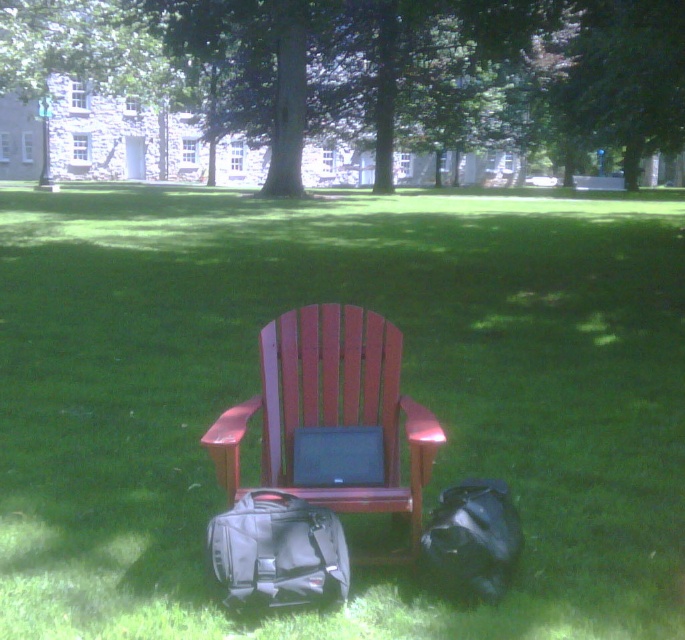
Which is above, green grass at center or black matte bag at lower right?

green grass at center is above.

Between green grass at center and black matte bag at lower right, which one appears on the left side from the viewer's perspective?

green grass at center is more to the left.

Between point (560, 392) and point (473, 497), which one is positioned behind?

The point (560, 392) is more distant.

Identify the location of green grass at center. (401, 390).

Who is higher up, green leafy tree at upper center or black fabric backpack at lower left?

Positioned higher is green leafy tree at upper center.

Consider the image. Who is more distant from viewer, (640, 72) or (329, 579)?

The point (640, 72) is more distant.

Image resolution: width=685 pixels, height=640 pixels. What are the coordinates of `green leafy tree at upper center` in the screenshot? It's located at (625, 77).

Between green grass at center and green leafy tree at center, which one is positioned higher?

green leafy tree at center is higher up.

Can you confirm if green grass at center is bigger than green leafy tree at center?

No, green grass at center is not bigger than green leafy tree at center.

At what (x,y) coordinates should I click in order to perform the action: click on green grass at center. Please return your answer as a coordinate pair (x, y). The width and height of the screenshot is (685, 640). Looking at the image, I should click on (401, 390).